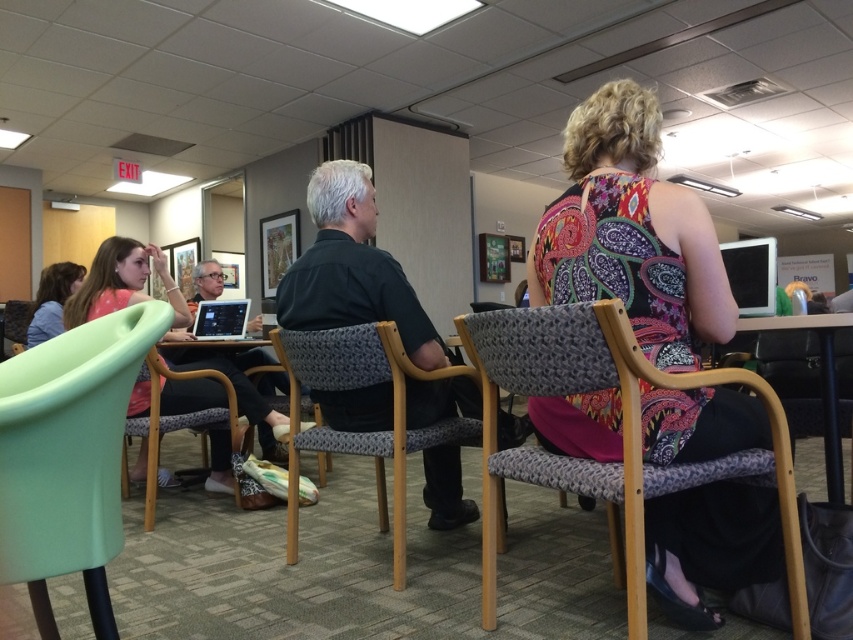
You are a photographer trying to capture a candid shot of the person in the matte black shirt at center without them noticing. Since you want to avoid the matte black laptop at center from blocking the view, which side should you position yourself relative to the person?

You should position yourself to the left of the person in the matte black shirt at center because the matte black laptop at center is to the right of them, so positioning yourself on the left would keep the laptop out of the frame.

You are standing at the entrance of the lounge and want to sit in the patterned fabric chair at center. Based on the coordinates provided, in which direction should you walk to reach the chair?

The patterned fabric chair at center is located at coordinates point (387, 403), which means you should walk towards the center of the lounge to reach it.

You are designing a layout for a small office space and need to place both the black woven chair at center and the black glossy tablet at upper right. Given their sizes, which object should you allocate more space for in your design?

The black woven chair at center is bigger than the black glossy tablet at upper right, so you should allocate more space for the black woven chair at center in your design.